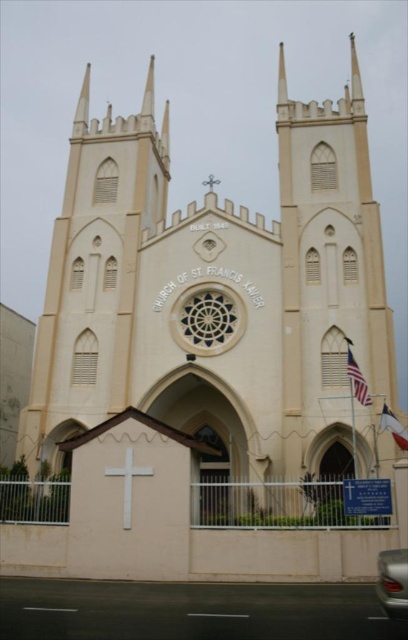
Which is below, american flag at right or blue fabric flag at center?

Positioned lower is blue fabric flag at center.

Does american flag at right appear over blue fabric flag at center?

Yes, american flag at right is above blue fabric flag at center.

Who is more distant from viewer, (361, 374) or (403, 436)?

Point (361, 374)

I want to click on american flag at right, so click(x=357, y=378).

Is white matte cross at center wider than white wooden cross at center?

Correct, the width of white matte cross at center exceeds that of white wooden cross at center.

Can you confirm if white matte cross at center is bigger than white wooden cross at center?

Incorrect, white matte cross at center is not larger than white wooden cross at center.

Does point (124, 456) come in front of point (204, 180)?

Yes.

Find the location of a particular element. The image size is (408, 640). white matte cross at center is located at coordinates (128, 483).

Between american flag at right and white wooden cross at center, which one appears on the left side from the viewer's perspective?

white wooden cross at center

Where is `american flag at right`? The width and height of the screenshot is (408, 640). american flag at right is located at coordinates (357, 378).

Find the location of a particular element. american flag at right is located at coordinates (357, 378).